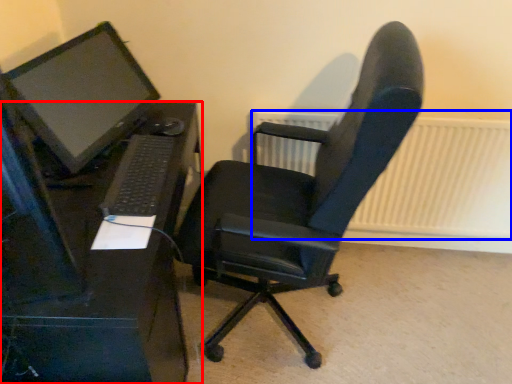
Question: Among these objects, which one is nearest to the camera, desk (highlighted by a red box) or radiator (highlighted by a blue box)?

Choices:
 (A) desk
 (B) radiator

Answer: (A)